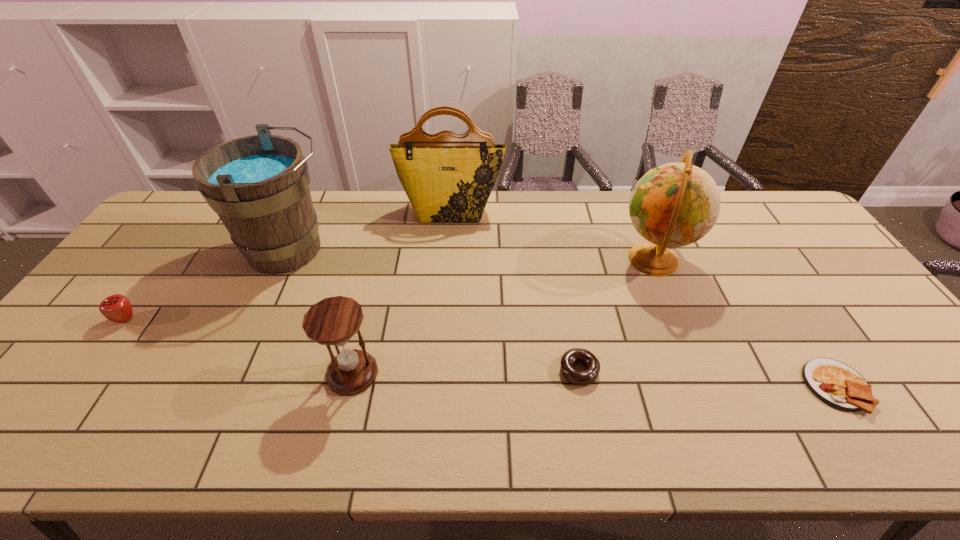
Image resolution: width=960 pixels, height=540 pixels. I want to click on vacant space that satisfies the following two spatial constraints: 1. with a handle on the side of the sixth object from right to left; 2. on the right side of the doughnut, so click(235, 370).

Locate an element on the screen. The height and width of the screenshot is (540, 960). free space in the image that satisfies the following two spatial constraints: 1. on the back side of the fourth shortest object; 2. on the right side of the doughnut is located at coordinates (353, 370).

This screenshot has width=960, height=540. I want to click on free location that satisfies the following two spatial constraints: 1. on the back side of the sixth object from left to right; 2. on the left side of the apple, so click(170, 260).

Find the location of a particular element. free spot that satisfies the following two spatial constraints: 1. on the back side of the globe; 2. with a handle on the side of the sixth object from right to left is located at coordinates (649, 250).

Locate an element on the screen. The image size is (960, 540). free space that satisfies the following two spatial constraints: 1. on the back side of the apple; 2. on the left side of the second object from right to left is located at coordinates (170, 260).

This screenshot has height=540, width=960. Identify the location of vacant space that satisfies the following two spatial constraints: 1. with a handle on the side of the fourth tallest object; 2. on the left side of the sixth object from right to left. (234, 373).